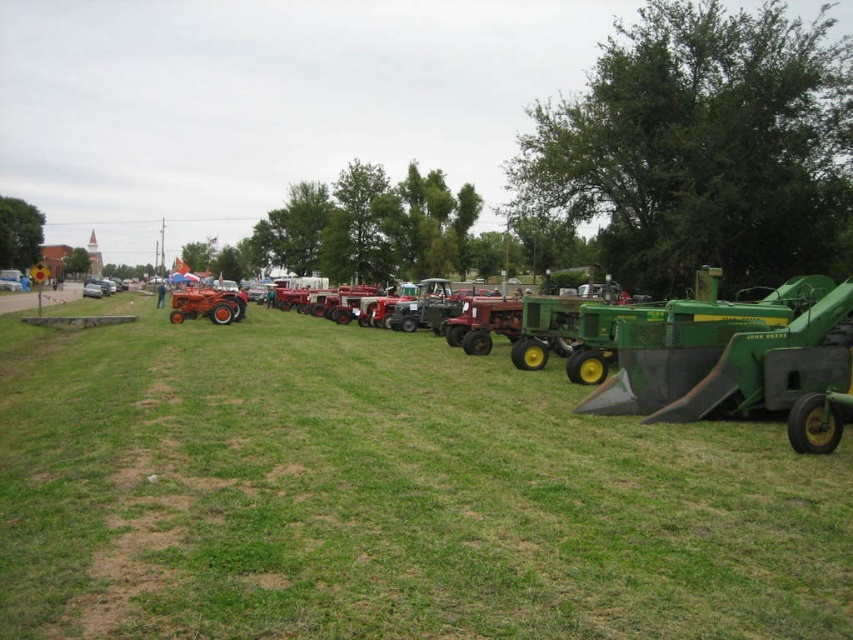
You are standing in the field and want to move from the green matte tractor at right to the matte red tractor at center. Which direction should you walk to get there?

You should walk to the left to reach the matte red tractor at center from the green matte tractor at right because the green matte tractor at right is to the right of the matte red tractor at center.

You are a farmer who needs to move a heavy load from the green matte tractor at right to the matte red tractor at center. The path between them is clear except for a small ditch that is 2 meters wide. Can your tractor safely navigate the ditch if it has a maximum turning radius of 5 meters?

The distance between the green matte tractor at right and the matte red tractor at center is 24.82 meters. Since the ditch is only 2 meters wide and the tractor has a maximum turning radius of 5 meters, the tractor can safely navigate around the ditch without any issues.